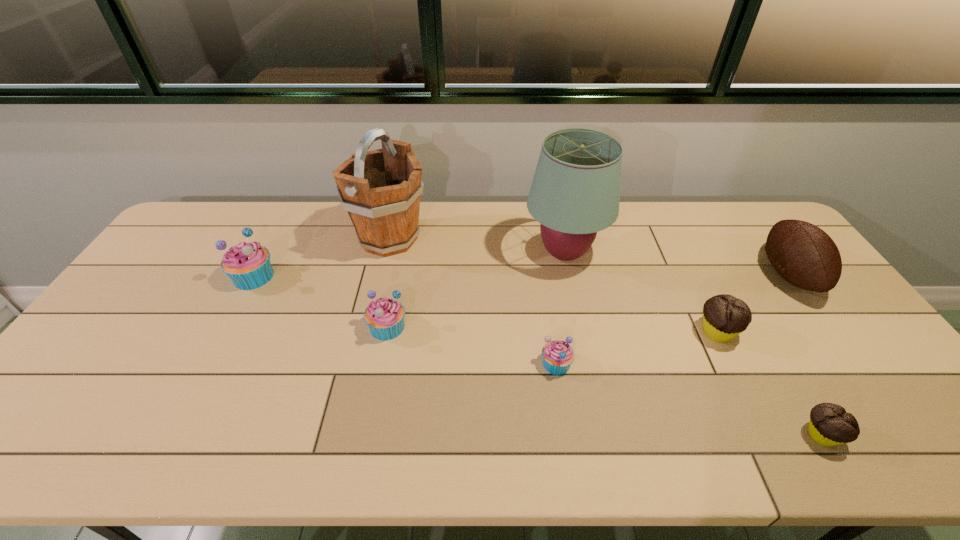
Identify the location of free space located 0.150m on the left of the fourth muffin from right to left. This screenshot has height=540, width=960. (313, 327).

Identify the location of blank space located 0.310m on the right of the left chocolate muffin. pyautogui.click(x=852, y=332).

The image size is (960, 540). I want to click on free location located 0.240m on the right of the rightmost blue muffin, so click(666, 363).

At what (x,y) coordinates should I click in order to perform the action: click on vacant area situated 0.170m on the left of the nearest muffin. Please return your answer as a coordinate pair (x, y). The height and width of the screenshot is (540, 960). Looking at the image, I should click on (726, 435).

Image resolution: width=960 pixels, height=540 pixels. What are the coordinates of `bucket located in the far edge section of the desktop` in the screenshot? It's located at (380, 189).

The image size is (960, 540). I want to click on lampshade that is at the far edge, so click(x=575, y=192).

Identify the location of object that is at the near edge. (830, 425).

Identify the location of object present at the right edge. Image resolution: width=960 pixels, height=540 pixels. (804, 255).

I want to click on vacant region at the far edge of the desktop, so click(x=676, y=213).

Find the location of a particular element. The image size is (960, 540). free spot at the near edge of the desktop is located at coordinates (510, 429).